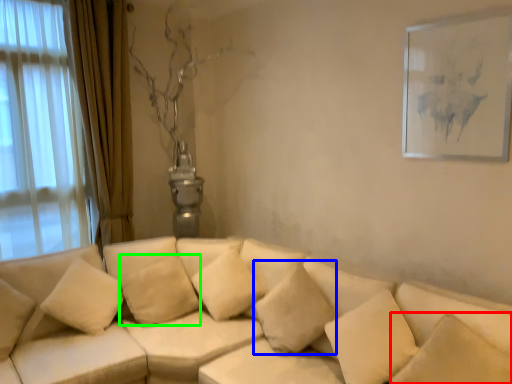
Question: Estimate the real-world distances between objects in this image. Which object is closer to pillow (highlighted by a red box), pillow (highlighted by a blue box) or pillow (highlighted by a green box)?

Choices:
 (A) pillow
 (B) pillow

Answer: (A)